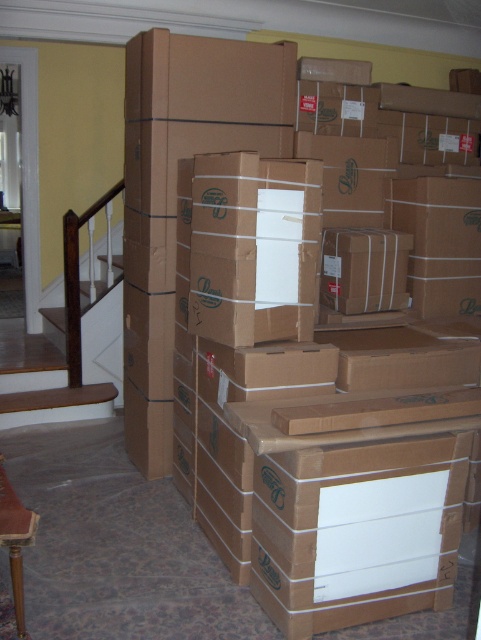
You are a delivery person who needs to place a new brown cardboard box at center in the room. According to the coordinates provided, where should you place it?

The brown cardboard box at center should be placed at point coordinates at point (301,388).

You are standing in the room with the boxes and need to reach both the point at [249,564] and the point at [15,374]. Which point will you reach first?

You will reach point [249,564] first because it is closer to you than point [15,374].